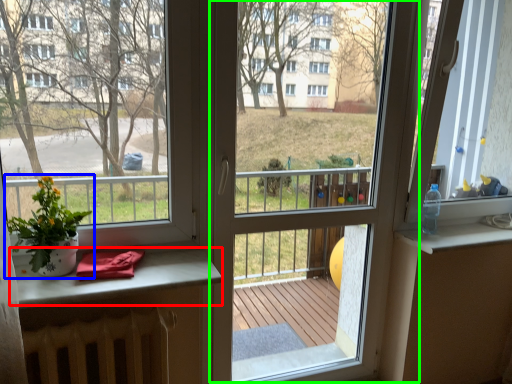
Question: Considering the real-world distances, which object is closest to table (highlighted by a red box)? houseplant (highlighted by a blue box) or screen door (highlighted by a green box).

Choices:
 (A) houseplant
 (B) screen door

Answer: (A)